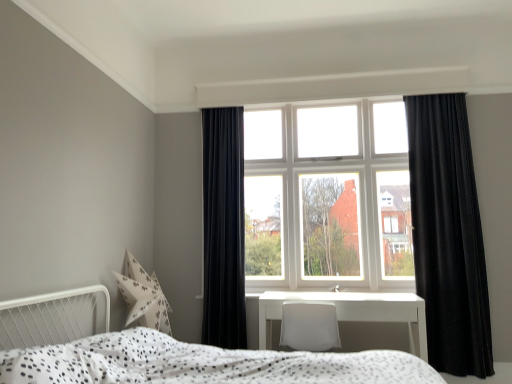
Question: Considering the relative positions of velvet black curtain at left, the second curtain in the right-to-left sequence, and black velvet curtain at right, placed as the 1th curtain when sorted from right to left, in the image provided, is velvet black curtain at left, the second curtain in the right-to-left sequence, to the left of black velvet curtain at right, placed as the 1th curtain when sorted from right to left, from the viewer's perspective?

Choices:
 (A) no
 (B) yes

Answer: (B)

Question: Is velvet black curtain at left, the first curtain positioned from the left, smaller than black velvet curtain at right, placed as the 1th curtain when sorted from right to left?

Choices:
 (A) yes
 (B) no

Answer: (A)

Question: Is velvet black curtain at left, the second curtain in the right-to-left sequence, far away from black velvet curtain at right, the 2th curtain viewed from the left?

Choices:
 (A) no
 (B) yes

Answer: (B)

Question: Is velvet black curtain at left, the first curtain positioned from the left, wider than black velvet curtain at right, placed as the 1th curtain when sorted from right to left?

Choices:
 (A) yes
 (B) no

Answer: (B)

Question: Does velvet black curtain at left, the second curtain in the right-to-left sequence, appear on the right side of black velvet curtain at right, the 2th curtain viewed from the left?

Choices:
 (A) yes
 (B) no

Answer: (B)

Question: Is velvet black curtain at left, the second curtain in the right-to-left sequence, not inside black velvet curtain at right, the 2th curtain viewed from the left?

Choices:
 (A) yes
 (B) no

Answer: (A)

Question: Is white glass window at center at the right side of white dotted fabric bed at lower center?

Choices:
 (A) yes
 (B) no

Answer: (A)

Question: Does white glass window at center lie in front of white dotted fabric bed at lower center?

Choices:
 (A) yes
 (B) no

Answer: (B)

Question: Would you say white glass window at center is a long distance from white dotted fabric bed at lower center?

Choices:
 (A) yes
 (B) no

Answer: (A)

Question: Is white glass window at center further to the viewer compared to white dotted fabric bed at lower center?

Choices:
 (A) yes
 (B) no

Answer: (A)

Question: Can you confirm if white glass window at center is shorter than white dotted fabric bed at lower center?

Choices:
 (A) yes
 (B) no

Answer: (B)

Question: Does white glass window at center have a smaller size compared to white dotted fabric bed at lower center?

Choices:
 (A) yes
 (B) no

Answer: (A)

Question: Considering the relative positions of velvet black curtain at left, the second curtain in the right-to-left sequence, and white glossy table at center in the image provided, is velvet black curtain at left, the second curtain in the right-to-left sequence, behind white glossy table at center?

Choices:
 (A) no
 (B) yes

Answer: (B)